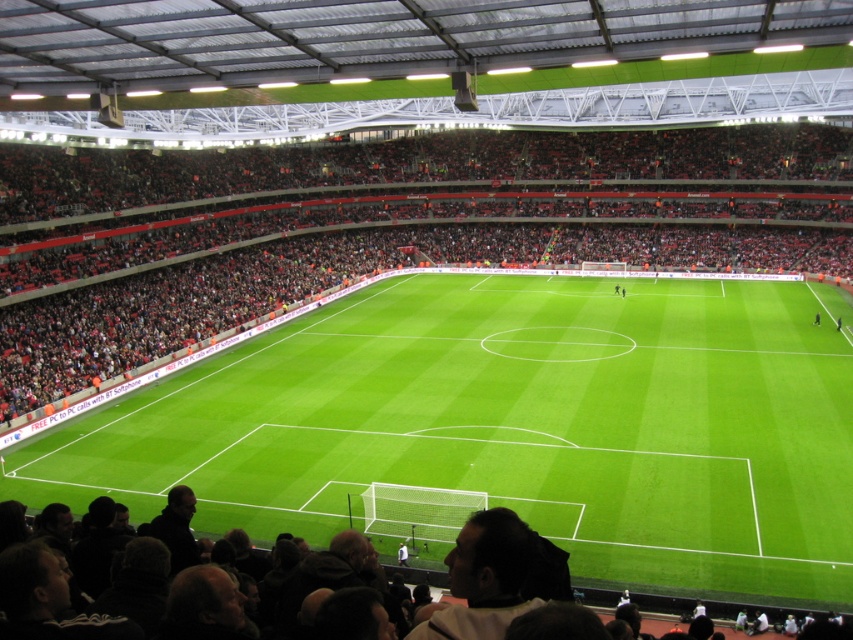
Who is more distant from viewer, [105,164] or [714,550]?

Positioned behind is point [105,164].

Looking at this image, can you confirm if red plastic seats at upper center is positioned below dark brown leather jacket at lower center?

No.

Which is behind, point (15, 321) or point (192, 524)?

Positioned behind is point (15, 321).

Identify the location of red plastic seats at upper center. (204, 301).

Which is more to the right, green grass football field at center or dark brown leather jacket at lower center?

Positioned to the right is green grass football field at center.

Who is more forward, (x=642, y=580) or (x=694, y=513)?

Point (x=642, y=580) is in front.

Between point (485, 465) and point (53, 493), which one is positioned in front?

Point (53, 493) is more forward.

The height and width of the screenshot is (640, 853). Identify the location of green grass football field at center. (515, 426).

Can you confirm if green grass football field at center is smaller than red plastic seats at upper center?

Indeed, green grass football field at center has a smaller size compared to red plastic seats at upper center.

Is the position of green grass football field at center more distant than that of red plastic seats at upper center?

No, it is in front of red plastic seats at upper center.

Which is behind, point (297, 461) or point (410, 211)?

The point (410, 211) is behind.

Find the location of a particular element. green grass football field at center is located at coordinates (515, 426).